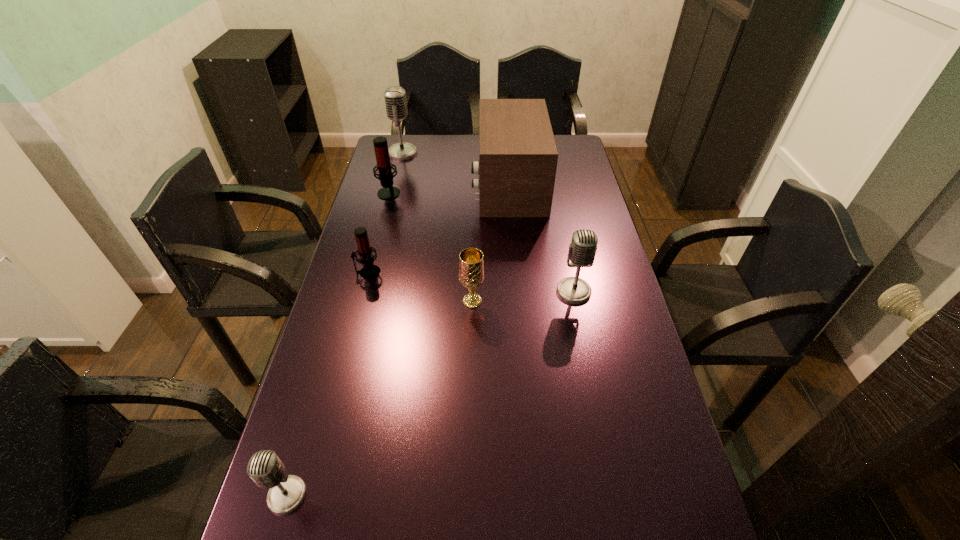
Point out which gray microphone is positioned as the second nearest to the nearer red microphone. Please provide its 2D coordinates. Your answer should be formatted as a tuple, i.e. [(x, y)], where the tuple contains the x and y coordinates of a point satisfying the conditions above.

[(287, 492)]

Image resolution: width=960 pixels, height=540 pixels. Identify the location of free point that satisfies the following two spatial constraints: 1. on the front side of the biggest gray microphone; 2. on the right side of the second biggest gray microphone. (369, 291).